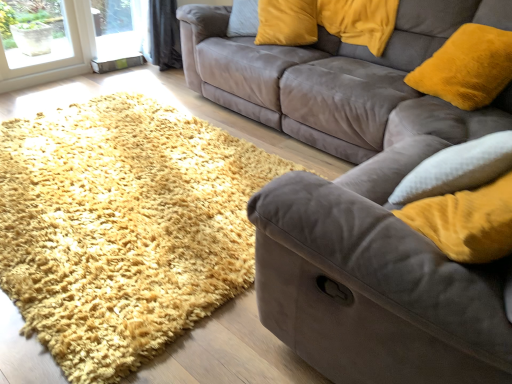
Question: Can you confirm if shaggy yellow rug at lower left is smaller than velvet yellow pillow at upper center, which is counted as the first pillow, starting from the left?

Choices:
 (A) no
 (B) yes

Answer: (A)

Question: Is velvet yellow pillow at upper center, which appears as the second pillow when viewed from the right, surrounded by shaggy yellow rug at lower left?

Choices:
 (A) yes
 (B) no

Answer: (B)

Question: Is shaggy yellow rug at lower left facing away from velvet yellow pillow at upper center, which appears as the second pillow when viewed from the right?

Choices:
 (A) yes
 (B) no

Answer: (B)

Question: Would you say shaggy yellow rug at lower left is a long distance from velvet yellow pillow at upper center, which appears as the second pillow when viewed from the right?

Choices:
 (A) no
 (B) yes

Answer: (B)

Question: Can you confirm if shaggy yellow rug at lower left is bigger than velvet yellow pillow at upper center, which appears as the second pillow when viewed from the right?

Choices:
 (A) no
 (B) yes

Answer: (B)

Question: From the image's perspective, is shaggy yellow rug at lower left over velvet yellow pillow at upper center, which is counted as the first pillow, starting from the left?

Choices:
 (A) yes
 (B) no

Answer: (B)

Question: Is velvet gray couch at center, which ranks as the second studio couch in front-to-back order, oriented towards velvet yellow pillow at upper center, which appears as the second pillow when viewed from the right?

Choices:
 (A) yes
 (B) no

Answer: (A)

Question: Is velvet yellow pillow at upper center, which is counted as the first pillow, starting from the left, surrounded by velvet gray couch at center, which ranks as the second studio couch in front-to-back order?

Choices:
 (A) no
 (B) yes

Answer: (B)

Question: Considering the relative positions of velvet gray couch at center, which appears as the 1th studio couch when viewed from the back, and velvet yellow pillow at upper center, which appears as the second pillow when viewed from the right, in the image provided, is velvet gray couch at center, which appears as the 1th studio couch when viewed from the back, to the right of velvet yellow pillow at upper center, which appears as the second pillow when viewed from the right, from the viewer's perspective?

Choices:
 (A) no
 (B) yes

Answer: (B)

Question: Does velvet gray couch at center, which ranks as the second studio couch in front-to-back order, have a smaller size compared to velvet yellow pillow at upper center, which is counted as the first pillow, starting from the left?

Choices:
 (A) no
 (B) yes

Answer: (A)

Question: From the image's perspective, is velvet gray couch at center, which ranks as the second studio couch in front-to-back order, on velvet yellow pillow at upper center, which is counted as the first pillow, starting from the left?

Choices:
 (A) no
 (B) yes

Answer: (A)

Question: Is the depth of velvet gray couch at center, which ranks as the second studio couch in front-to-back order, greater than that of velvet yellow pillow at upper center, which appears as the second pillow when viewed from the right?

Choices:
 (A) no
 (B) yes

Answer: (A)

Question: Could you tell me if velvet gray couch at center, which appears as the 1th studio couch when viewed from the back, is facing suede couch at center, the second studio couch positioned from the back?

Choices:
 (A) no
 (B) yes

Answer: (A)